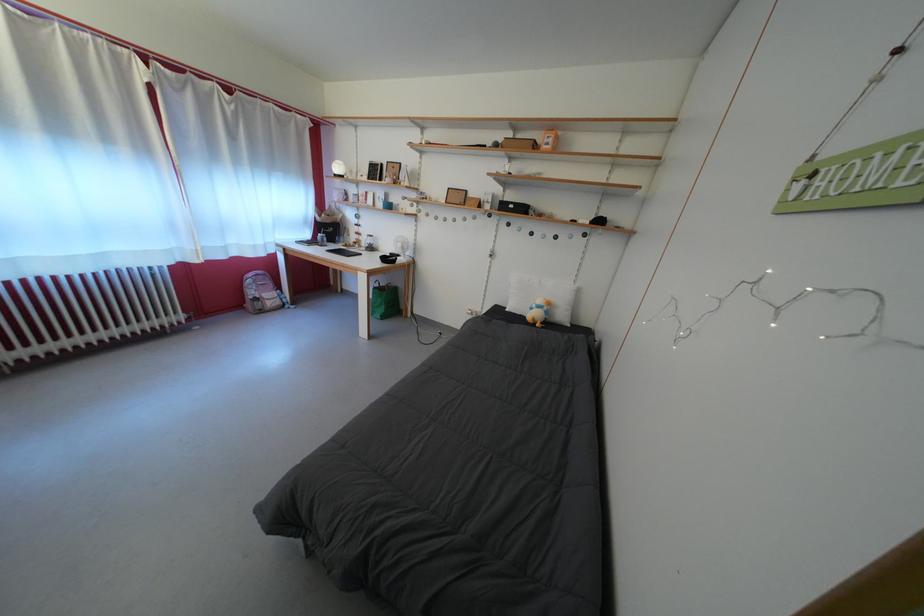
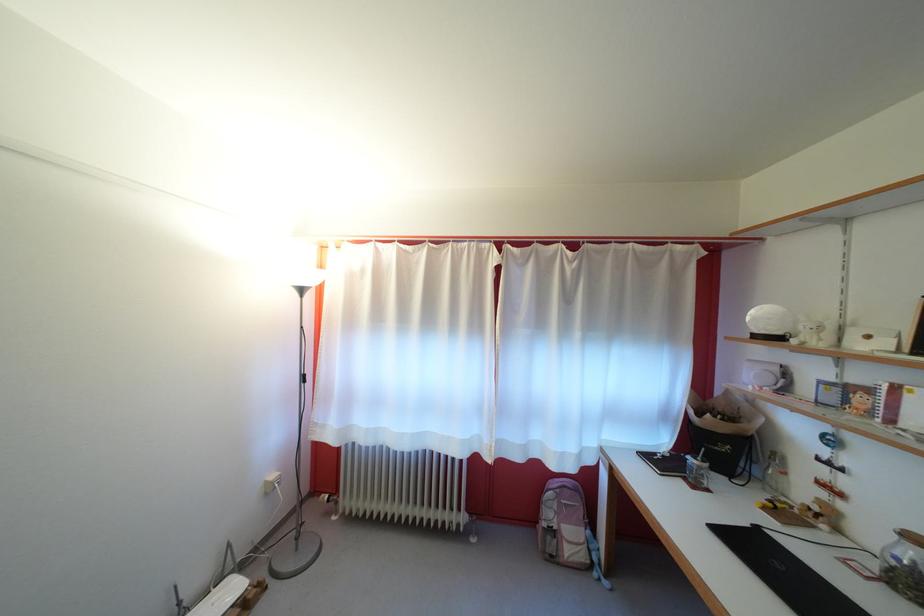
Locate, in the second image, the point that corresponds to pixel 331 244 in the first image.

(708, 474)